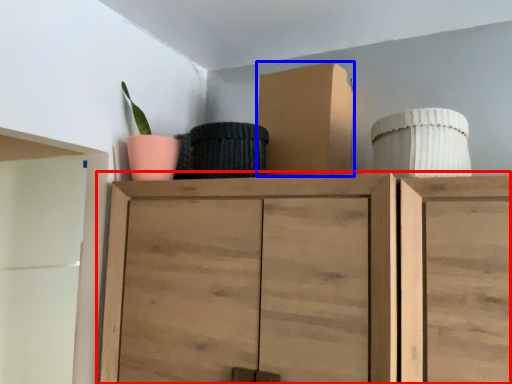
Question: Which object is further to the camera taking this photo, cupboard (highlighted by a red box) or cardboard box (highlighted by a blue box)?

Choices:
 (A) cupboard
 (B) cardboard box

Answer: (B)